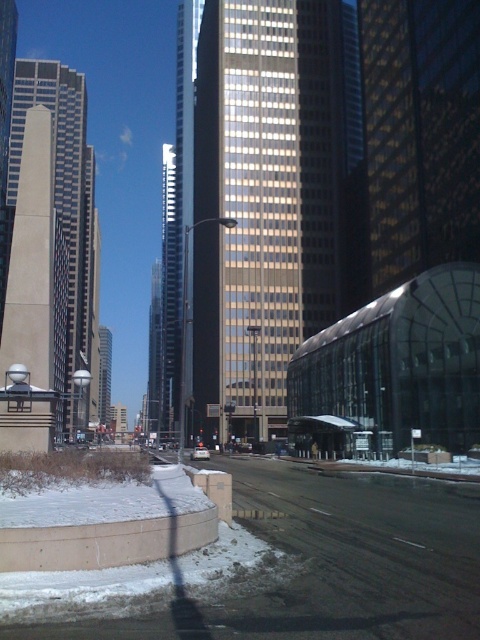
Question: Which point is farther from the camera taking this photo?

Choices:
 (A) (17, 268)
 (B) (255, 241)

Answer: (B)

Question: Where is gold reflective glass skyscraper at center located in relation to beige glass skyscraper at left in the image?

Choices:
 (A) left
 (B) right

Answer: (B)

Question: Can you confirm if gold reflective glass skyscraper at center is positioned to the right of beige glass skyscraper at left?

Choices:
 (A) no
 (B) yes

Answer: (B)

Question: Which point appears closest to the camera in this image?

Choices:
 (A) (336, 243)
 (B) (94, 372)

Answer: (A)

Question: Which point is farther from the camera taking this photo?

Choices:
 (A) (334, 8)
 (B) (47, 113)

Answer: (A)

Question: Does gold reflective glass skyscraper at center have a smaller size compared to beige glass skyscraper at left?

Choices:
 (A) yes
 (B) no

Answer: (A)